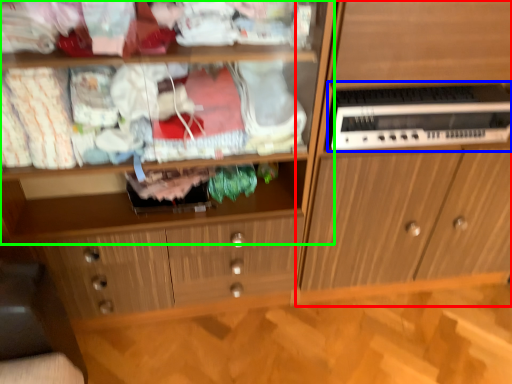
Question: Considering the real-world distances, which object is farthest from cabinetry (highlighted by a red box)? home appliance (highlighted by a blue box) or shelf (highlighted by a green box)?

Choices:
 (A) home appliance
 (B) shelf

Answer: (B)